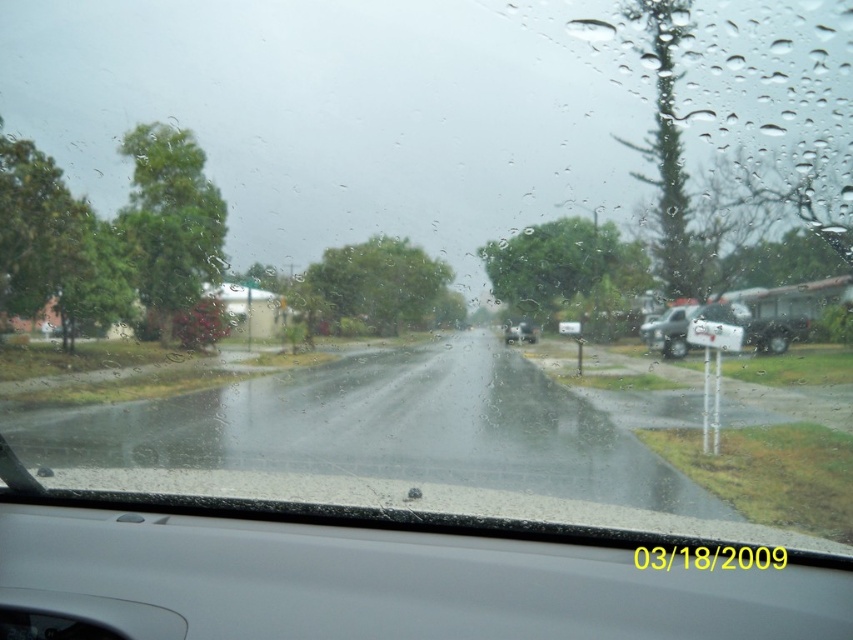
You are a driver navigating a rainy day and see two points on the road ahead. The first point is at coordinate point (193,573), and the second is at point (506,339). Which point is closer to your current position?

Point (193,573) is in front of point (506,339), so the first point is closer to your current position.

You are sitting in the driver seat of the car and looking through the windshield. There are two points marked on the windshield at coordinates point (653, 344) and point (506, 339). Which point is closer to you?

Point (653, 344) is closer to the viewer than point (506, 339).

You are driving a car and need to adjust your rearview mirror to see both the gray matte dashboard at center and the white matte truck at right. Which object is narrower and might require adjusting the mirror to focus more on the wider one?

The gray matte dashboard at center is thinner than the white matte truck at right, so you should adjust the mirror to focus more on the wider white matte truck at right to ensure proper visibility.